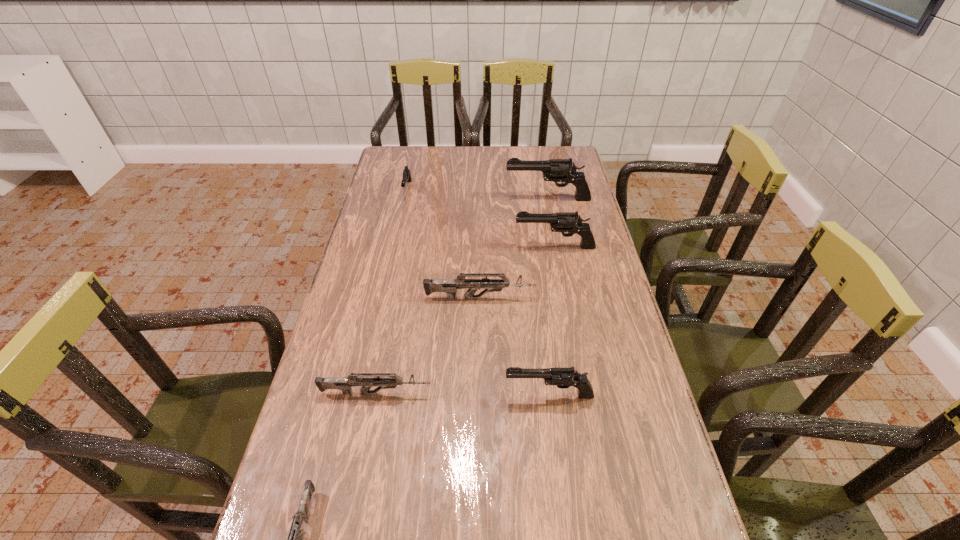
At what (x,y) coordinates should I click in order to perform the action: click on object that is the second closest one to the nearest gun. Please return your answer as a coordinate pair (x, y). This screenshot has width=960, height=540. Looking at the image, I should click on (563, 378).

Locate which object ranks fifth in proximity to the nearest black gun. Please provide its 2D coordinates. Your answer should be formatted as a tuple, i.e. [(x, y)], where the tuple contains the x and y coordinates of a point satisfying the conditions above.

[(557, 170)]

You are a GUI agent. You are given a task and a screenshot of the screen. Output one action in this format:
    pyautogui.click(x=<x>, y=<y>)
    Task: Click on the gun that can be found as the fifth closest to the tallest object
    This screenshot has height=540, width=960.
    Given the screenshot: What is the action you would take?
    pyautogui.click(x=366, y=380)

Identify the location of gun that stands as the fourth closest to the second tallest object. The image size is (960, 540). (563, 378).

Select which black gun appears as the third closest to the biggest grey gun. Please provide its 2D coordinates. Your answer should be formatted as a tuple, i.e. [(x, y)], where the tuple contains the x and y coordinates of a point satisfying the conditions above.

[(557, 170)]

Find the location of `black gun that is the fourth nearest to the nearest gun`. black gun that is the fourth nearest to the nearest gun is located at coordinates tap(557, 170).

Locate an element on the screen. Image resolution: width=960 pixels, height=540 pixels. grey gun identified as the second closest to the farthest grey gun is located at coordinates (295, 538).

Select which grey gun appears as the third closest to the fifth nearest object. Please provide its 2D coordinates. Your answer should be formatted as a tuple, i.e. [(x, y)], where the tuple contains the x and y coordinates of a point satisfying the conditions above.

[(295, 538)]